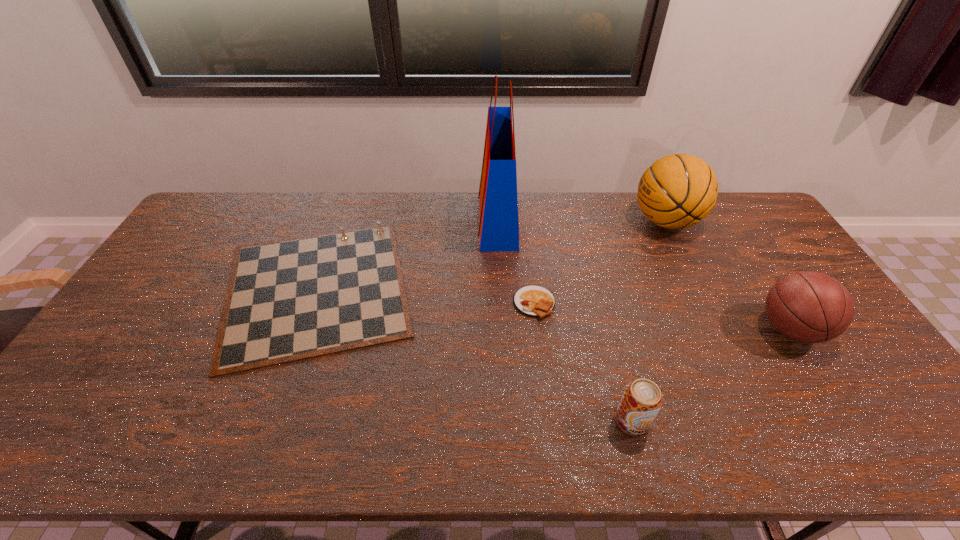
At what (x,y) coordinates should I click in order to perform the action: click on vacant area between the beer can and the second tallest object. Please return your answer as a coordinate pair (x, y). Image resolution: width=960 pixels, height=540 pixels. Looking at the image, I should click on (649, 321).

You are a GUI agent. You are given a task and a screenshot of the screen. Output one action in this format:
    pyautogui.click(x=<x>, y=<y>)
    Task: Click on the free spot between the fifth tallest object and the nearest object
    
    Given the screenshot: What is the action you would take?
    pyautogui.click(x=474, y=354)

This screenshot has width=960, height=540. What are the coordinates of `free spot between the second shortest object and the taller basketball` in the screenshot? It's located at (492, 255).

Find the location of a particular element. The height and width of the screenshot is (540, 960). free space between the shortest object and the third tallest object is located at coordinates (662, 316).

Identify the location of vacant space that's between the omelet and the tallest object. The height and width of the screenshot is (540, 960). (516, 261).

The height and width of the screenshot is (540, 960). Find the location of `vacant space that's between the taller basketball and the tallest object`. vacant space that's between the taller basketball and the tallest object is located at coordinates (582, 220).

Identify the location of vacant space in between the tallest object and the second shortest object. (407, 254).

Where is `empty space that is in between the fourth tallest object and the gameboard`? empty space that is in between the fourth tallest object and the gameboard is located at coordinates (474, 354).

Locate an element on the screen. This screenshot has height=540, width=960. vacant space that is in between the shopping bag and the nearest object is located at coordinates (564, 320).

Identify the location of object that stands as the second closest to the third tallest object. (641, 401).